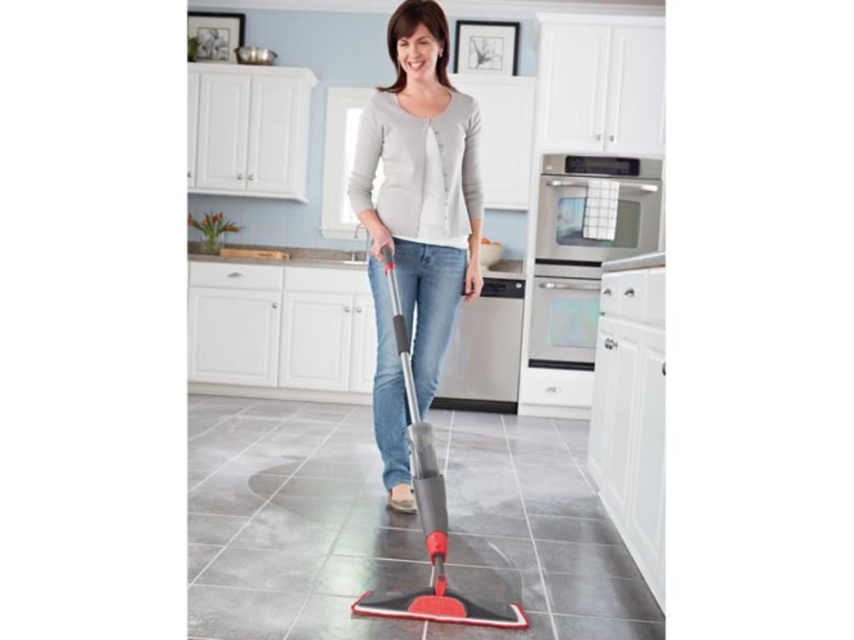
Question: Which point is farther to the camera?

Choices:
 (A) red rubber mop at center
 (B) gray matte sweater at center

Answer: (B)

Question: Can you confirm if gray matte sweater at center is positioned to the right of red rubber mop at center?

Choices:
 (A) no
 (B) yes

Answer: (B)

Question: Where is gray matte sweater at center located in relation to red rubber mop at center in the image?

Choices:
 (A) left
 (B) right

Answer: (B)

Question: Which object appears farthest from the camera in this image?

Choices:
 (A) red rubber mop at center
 (B) gray matte sweater at center

Answer: (B)

Question: Does gray matte sweater at center appear on the right side of red rubber mop at center?

Choices:
 (A) no
 (B) yes

Answer: (B)